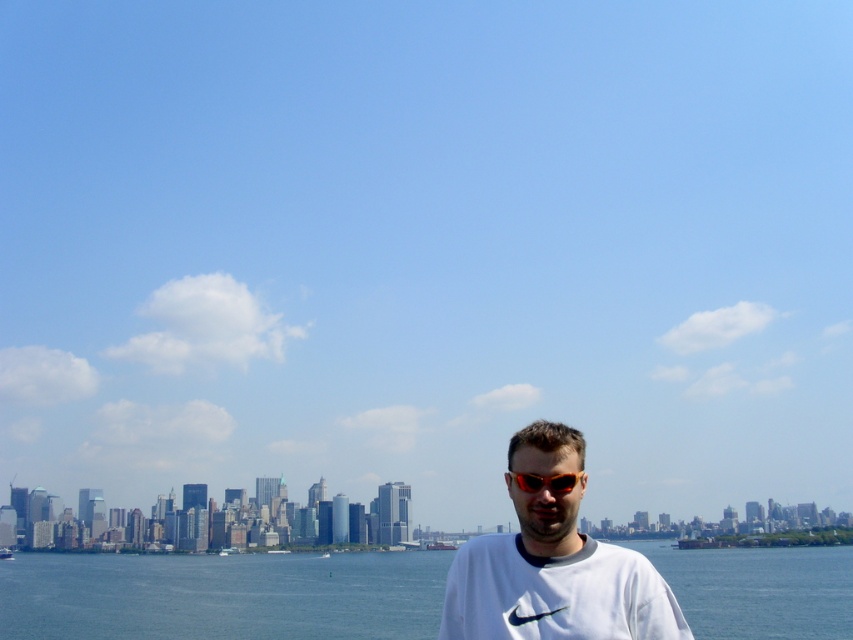
Question: Does blue water at lower center appear on the left side of white cotton t-shirt at center?

Choices:
 (A) yes
 (B) no

Answer: (A)

Question: Can you confirm if white cotton t-shirt at center is smaller than orange reflective sunglasses at center?

Choices:
 (A) no
 (B) yes

Answer: (A)

Question: Which object appears farthest from the camera in this image?

Choices:
 (A) orange reflective sunglasses at center
 (B) blue water at lower center
 (C) white cotton t-shirt at center

Answer: (B)

Question: Which of the following is the closest to the observer?

Choices:
 (A) blue water at lower center
 (B) white cotton t-shirt at center
 (C) orange reflective sunglasses at center

Answer: (B)

Question: Is blue water at lower center below white cotton t-shirt at center?

Choices:
 (A) no
 (B) yes

Answer: (B)

Question: Which point is farther from the camera taking this photo?

Choices:
 (A) (527, 490)
 (B) (697, 614)

Answer: (B)